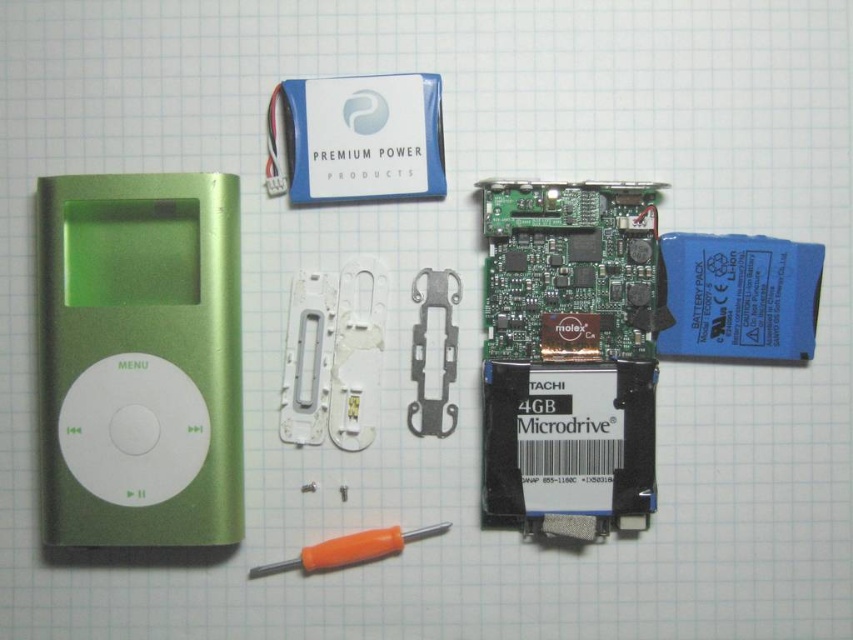
You are a technician working on an iPod repair. You have the green metallic ipod at left and the orange plastic screwdriver at center. Which object is thinner?

The green metallic ipod at left is thinner than the orange plastic screwdriver at center according to the description.

You are a technician working on an iPod repair. You need to place the orange plastic screwdriver at center closer to the right edge of the workspace. Which direction should you move it relative to the green metallic ipod at left?

You should move the orange plastic screwdriver at center to the right of the green metallic ipod at left. Since the green metallic ipod at left is already to the left of the orange plastic screwdriver at center, moving it further right would position it closer to the right edge of the workspace.

You are a technician working on an iPod repair. You need to place the orange plastic screwdriver at center closer to the green metallic ipod at left. Based on their current positions, which direction should you move the screwdriver?

The green metallic ipod at left is above the orange plastic screwdriver at center, so to move the screwdriver closer to the iPod, you should move it upward.